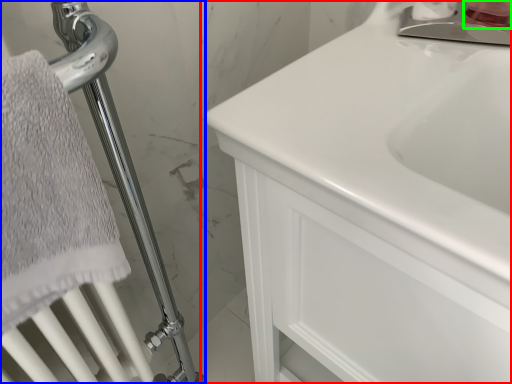
Question: Estimate the real-world distances between objects in this image. Which object is closer to bathroom cabinet (highlighted by a red box), shower (highlighted by a blue box) or toiletry (highlighted by a green box)?

Choices:
 (A) shower
 (B) toiletry

Answer: (A)